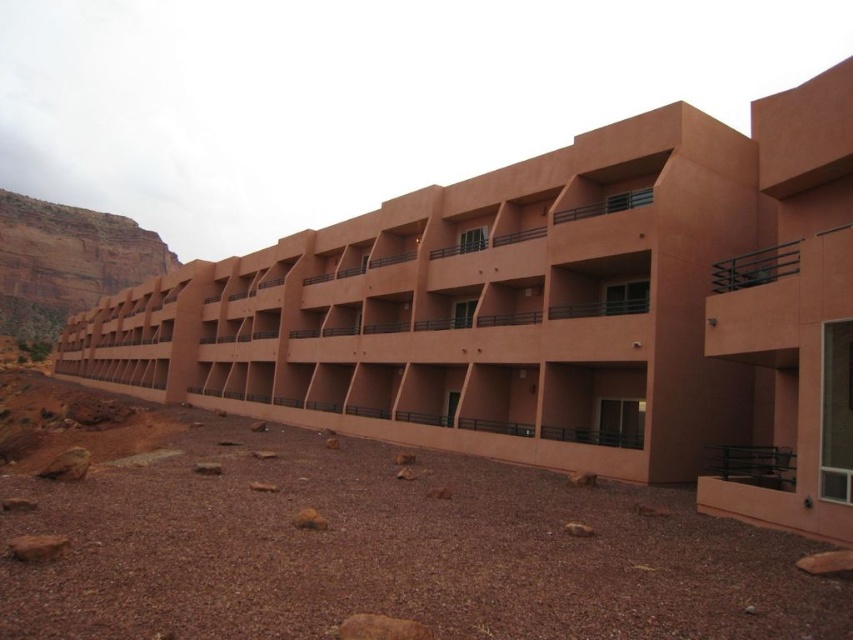
You are standing in front of the matte orange building at center and want to walk to the rustic stone cliff at left. Which direction should you face to move towards it?

You should face to the left to move towards the rustic stone cliff at left since the matte orange building at center is to the right of rustic stone cliff at left.

You are an architect evaluating the spatial layout of the matte orange building at center and the rustic stone cliff at left. Which structure occupies more horizontal space in the image?

The matte orange building at center is wider than the rustic stone cliff at left, so it occupies more horizontal space in the image.